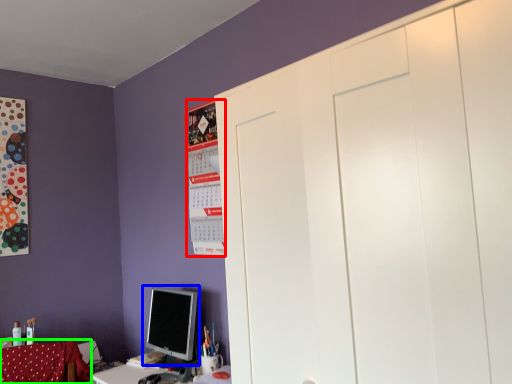
Question: Which object is the farthest from bulletin board (highlighted by a red box)? Choose among these: computer monitor (highlighted by a blue box) or swivel chair (highlighted by a green box).

Choices:
 (A) computer monitor
 (B) swivel chair

Answer: (B)